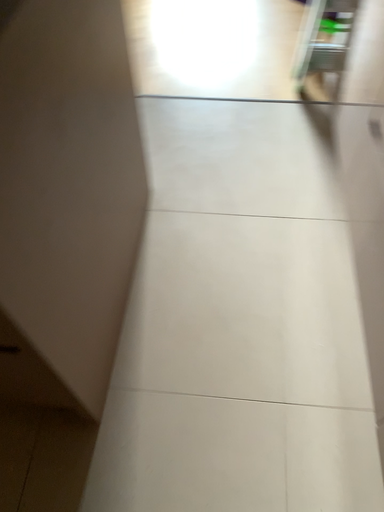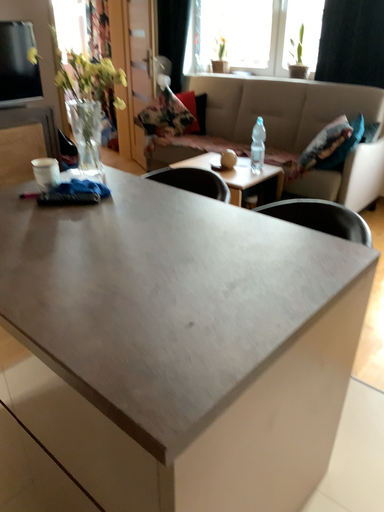
Question: Which way did the camera rotate in the video?

Choices:
 (A) rotated upward
 (B) rotated downward

Answer: (A)